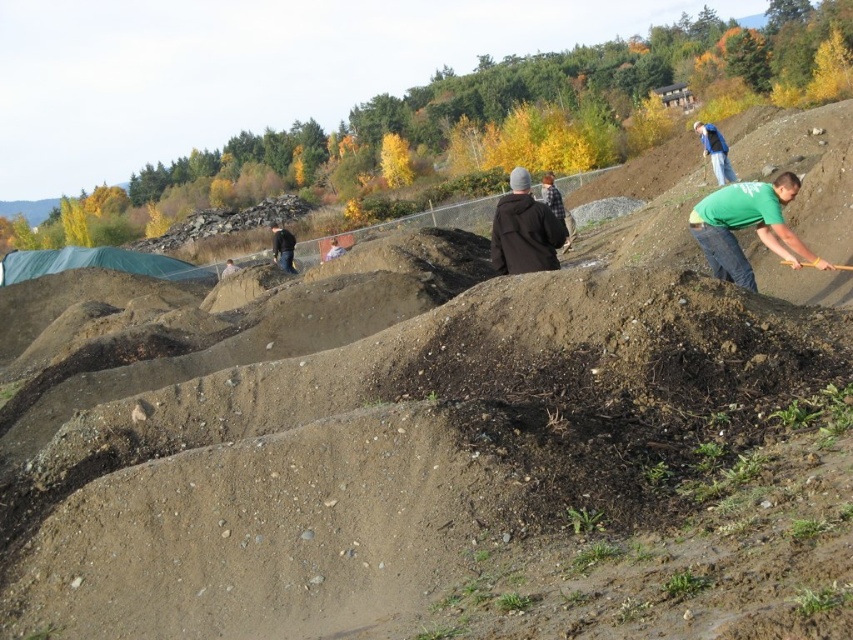
You are a worker at the construction site and you need to locate your equipment. You have a light brown leather jacket at center and a black fabric at center. Which item is covering the other one?

The light brown leather jacket at center is positioned over the black fabric at center, so the jacket is covering the fabric.

You are a delivery person standing at the edge of the construction site. You need to deliver a package to the person wearing the light brown leather jacket at center and the black fabric at center. The delivery cart you are using has a maximum range of 4 meters. Can you reach both individuals with the cart without moving it?

The light brown leather jacket at center and black fabric at center are 3.94 meters apart. Since the delivery cart has a maximum range of 4 meters, you can reach both individuals as the distance between them is within the cart s range.

You are a construction worker who needs to carry both the dark brown leather jacket at center and the wooden shovel at right. Which item should you pick up first if you want to carry the larger item first?

The dark brown leather jacket at center is bigger than the wooden shovel at right, so you should pick up the dark brown leather jacket at center first.